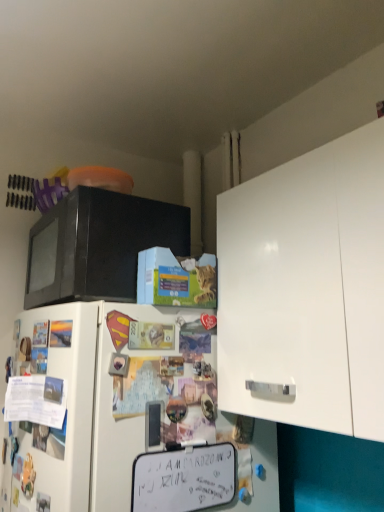
Describe the element at coordinates (184, 478) in the screenshot. I see `white matte dry erase board at lower center` at that location.

Where is `white matte cabinet at upper right`? The width and height of the screenshot is (384, 512). white matte cabinet at upper right is located at coordinates (307, 288).

Do you think white matte dry erase board at lower center is within black matte microwave at upper left, or outside of it?

The correct answer is: outside.

Which is closer to the camera, (205, 500) or (146, 207)?

Point (205, 500) is positioned closer to the camera compared to point (146, 207).

Considering the relative sizes of white matte dry erase board at lower center and black matte microwave at upper left in the image provided, is white matte dry erase board at lower center bigger than black matte microwave at upper left?

No, white matte dry erase board at lower center is not bigger than black matte microwave at upper left.

From the image's perspective, is white matte dry erase board at lower center under black matte microwave at upper left?

Correct, white matte dry erase board at lower center appears lower than black matte microwave at upper left in the image.

Is point (32, 357) closer or farther from the camera than point (164, 472)?

Clearly, point (32, 357) is more distant from the camera than point (164, 472).

Considering the sizes of objects white matte refrigerator at lower left and white matte dry erase board at lower center in the image provided, who is taller, white matte refrigerator at lower left or white matte dry erase board at lower center?

white matte refrigerator at lower left.

In the scene shown: Is white matte refrigerator at lower left far away from white matte dry erase board at lower center?

That's not correct — white matte refrigerator at lower left is a little close to white matte dry erase board at lower center.

Measure the distance from white matte refrigerator at lower left to white matte dry erase board at lower center.

white matte refrigerator at lower left is 6.42 inches away from white matte dry erase board at lower center.

From a real-world perspective, which is physically above, white matte dry erase board at lower center or white matte cabinet at upper right?

white matte cabinet at upper right.

Between white matte dry erase board at lower center and white matte cabinet at upper right, which one has less height?

white matte dry erase board at lower center.

In terms of width, does white matte dry erase board at lower center look wider or thinner when compared to white matte cabinet at upper right?

Considering their sizes, white matte dry erase board at lower center looks slimmer than white matte cabinet at upper right.

Is white matte refrigerator at lower left oriented towards black matte microwave at upper left?

No, white matte refrigerator at lower left is not facing towards black matte microwave at upper left.

From a real-world perspective, which object rests below the other?

white matte refrigerator at lower left is physically lower.

Which of these two, white matte refrigerator at lower left or black matte microwave at upper left, is thinner?

black matte microwave at upper left.

Locate an element on the screen. refrigerator below the black matte microwave at upper left (from a real-world perspective) is located at coordinates (113, 409).

Where is `refrigerator located behind the white matte cabinet at upper right`? refrigerator located behind the white matte cabinet at upper right is located at coordinates (113, 409).

Considering the sizes of objects white matte cabinet at upper right and white matte refrigerator at lower left in the image provided, who is wider, white matte cabinet at upper right or white matte refrigerator at lower left?

Wider between the two is white matte refrigerator at lower left.

Is white matte cabinet at upper right inside the boundaries of white matte refrigerator at lower left, or outside?

white matte cabinet at upper right lies outside white matte refrigerator at lower left.

From a real-world perspective, which object rests below the other?

white matte refrigerator at lower left is physically lower.

Identify the location of refrigerator that is on the right side of black matte microwave at upper left. The image size is (384, 512). (113, 409).

From the picture: Is black matte microwave at upper left positioned with its back to white matte refrigerator at lower left?

No, black matte microwave at upper left's orientation is not away from white matte refrigerator at lower left.

Measure the distance from black matte microwave at upper left to white matte refrigerator at lower left.

A distance of 11.17 inches exists between black matte microwave at upper left and white matte refrigerator at lower left.

How different are the orientations of white matte cabinet at upper right and black matte microwave at upper left in degrees?

0.824 degrees separate the facing orientations of white matte cabinet at upper right and black matte microwave at upper left.

Considering the relative sizes of white matte cabinet at upper right and black matte microwave at upper left in the image provided, is white matte cabinet at upper right smaller than black matte microwave at upper left?

No, white matte cabinet at upper right is not smaller than black matte microwave at upper left.

Looking at this image, can you see white matte cabinet at upper right touching black matte microwave at upper left?

No, white matte cabinet at upper right is not in contact with black matte microwave at upper left.

Identify the location of microwave oven located behind the white matte cabinet at upper right. click(x=98, y=245).

Identify the location of microwave oven behind the white matte dry erase board at lower center. (98, 245).

This screenshot has width=384, height=512. What are the coordinates of `bulletin board below the white matte refrigerator at lower left (from the image's perspective)` in the screenshot? It's located at (184, 478).

When comparing their distances from white matte dry erase board at lower center, does black matte microwave at upper left or white matte cabinet at upper right seem closer?

The object closer to white matte dry erase board at lower center is white matte cabinet at upper right.

Considering their positions, is white matte refrigerator at lower left positioned further to black matte microwave at upper left than white matte cabinet at upper right?

white matte cabinet at upper right is positioned further to the anchor black matte microwave at upper left.

Based on their spatial positions, is white matte refrigerator at lower left or black matte microwave at upper left closer to white matte cabinet at upper right?

white matte refrigerator at lower left.

Which object lies nearer to the anchor point white matte dry erase board at lower center, white matte refrigerator at lower left or black matte microwave at upper left?

Based on the image, white matte refrigerator at lower left appears to be nearer to white matte dry erase board at lower center.

Looking at the image, which one is located closer to white matte cabinet at upper right, black matte microwave at upper left or white matte dry erase board at lower center?

black matte microwave at upper left is closer to white matte cabinet at upper right.

When comparing their distances from white matte refrigerator at lower left, does white matte dry erase board at lower center or black matte microwave at upper left seem further?

Among the two, black matte microwave at upper left is located further to white matte refrigerator at lower left.

Looking at the image, which one is located further to white matte refrigerator at lower left, white matte cabinet at upper right or black matte microwave at upper left?

The object further to white matte refrigerator at lower left is white matte cabinet at upper right.

Looking at the image, which one is located closer to white matte dry erase board at lower center, black matte microwave at upper left or white matte refrigerator at lower left?

white matte refrigerator at lower left.

The image size is (384, 512). I want to click on refrigerator between black matte microwave at upper left and white matte dry erase board at lower center in the up-down direction, so click(113, 409).

The width and height of the screenshot is (384, 512). What are the coordinates of `bulletin board between black matte microwave at upper left and white matte cabinet at upper right from left to right` in the screenshot? It's located at (184, 478).

Locate an element on the screen. This screenshot has width=384, height=512. refrigerator between black matte microwave at upper left and white matte cabinet at upper right is located at coordinates (113, 409).

This screenshot has height=512, width=384. What are the coordinates of `bulletin board located between white matte refrigerator at lower left and white matte cabinet at upper right in the left-right direction` in the screenshot? It's located at (184, 478).